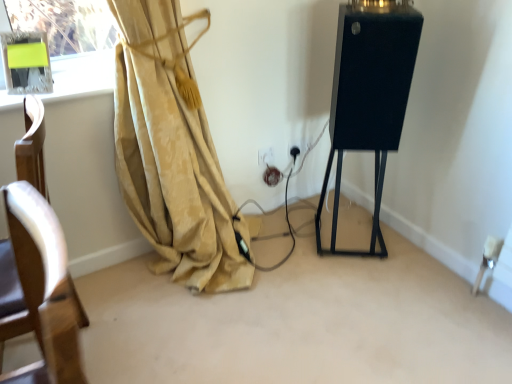
Question: From a real-world perspective, is white plastic electric outlet at lower center under black fabric speaker at right?

Choices:
 (A) yes
 (B) no

Answer: (A)

Question: Does white plastic electric outlet at lower center turn towards black fabric speaker at right?

Choices:
 (A) no
 (B) yes

Answer: (B)

Question: Does white plastic electric outlet at lower center have a larger size compared to black fabric speaker at right?

Choices:
 (A) yes
 (B) no

Answer: (B)

Question: Is white plastic electric outlet at lower center facing away from black fabric speaker at right?

Choices:
 (A) yes
 (B) no

Answer: (B)

Question: Is white plastic electric outlet at lower center placed right next to black fabric speaker at right?

Choices:
 (A) yes
 (B) no

Answer: (B)

Question: Is black fabric speaker at right located within white plastic electric outlet at lower center?

Choices:
 (A) yes
 (B) no

Answer: (B)

Question: Could you tell me if black fabric speaker at right is facing white plastic electric outlet at lower center?

Choices:
 (A) yes
 (B) no

Answer: (B)

Question: Does black fabric speaker at right have a lesser width compared to white plastic electric outlet at lower center?

Choices:
 (A) yes
 (B) no

Answer: (B)

Question: Does black fabric speaker at right appear on the right side of white plastic electric outlet at lower center?

Choices:
 (A) no
 (B) yes

Answer: (B)

Question: Does black fabric speaker at right appear on the left side of white plastic electric outlet at lower center?

Choices:
 (A) yes
 (B) no

Answer: (B)

Question: From the image's perspective, is black fabric speaker at right located beneath white plastic electric outlet at lower center?

Choices:
 (A) yes
 (B) no

Answer: (B)

Question: Does black fabric speaker at right lie behind white plastic electric outlet at lower center?

Choices:
 (A) yes
 (B) no

Answer: (B)

Question: From a real-world perspective, is white plastic electric outlet at lower center positioned above or below black fabric speaker at right?

Choices:
 (A) below
 (B) above

Answer: (A)